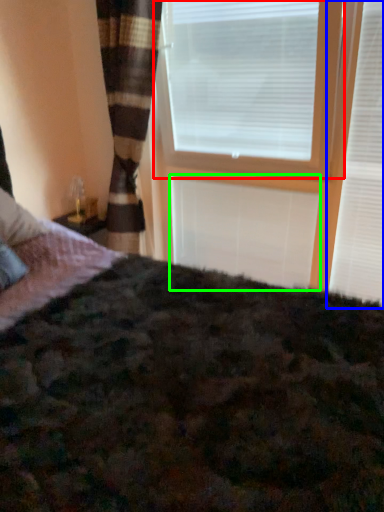
Question: Based on their relative distances, which object is farther from window blind (highlighted by a red box)? Choose from window blind (highlighted by a blue box) and blind (highlighted by a green box).

Choices:
 (A) window blind
 (B) blind

Answer: (A)